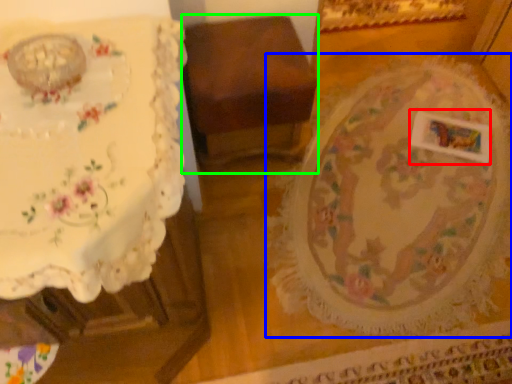
Question: Considering the real-world distances, which object is farthest from square (highlighted by a red box)? round table (highlighted by a blue box) or furniture (highlighted by a green box)?

Choices:
 (A) round table
 (B) furniture

Answer: (B)